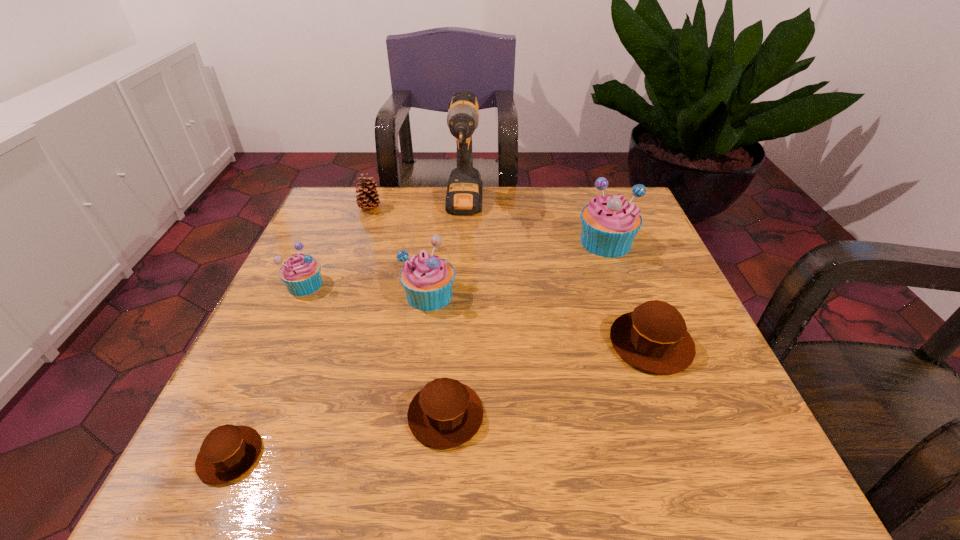
Identify which brown muffin is the second nearest to the shortest object. Please provide its 2D coordinates. Your answer should be formatted as a tuple, i.e. [(x, y)], where the tuple contains the x and y coordinates of a point satisfying the conditions above.

[(653, 337)]

Identify which brown muffin is the second closest to the leftmost blue muffin. Please provide its 2D coordinates. Your answer should be formatted as a tuple, i.e. [(x, y)], where the tuple contains the x and y coordinates of a point satisfying the conditions above.

[(445, 414)]

Locate an element on the screen. vacant space that satisfies the following two spatial constraints: 1. with the drill bit of the rightmost blue muffin facing forward; 2. on the right side of the drill is located at coordinates (463, 242).

Where is `free location that satisfies the following two spatial constraints: 1. on the back side of the shortest muffin; 2. on the right side of the pinecone`? This screenshot has width=960, height=540. free location that satisfies the following two spatial constraints: 1. on the back side of the shortest muffin; 2. on the right side of the pinecone is located at coordinates (340, 208).